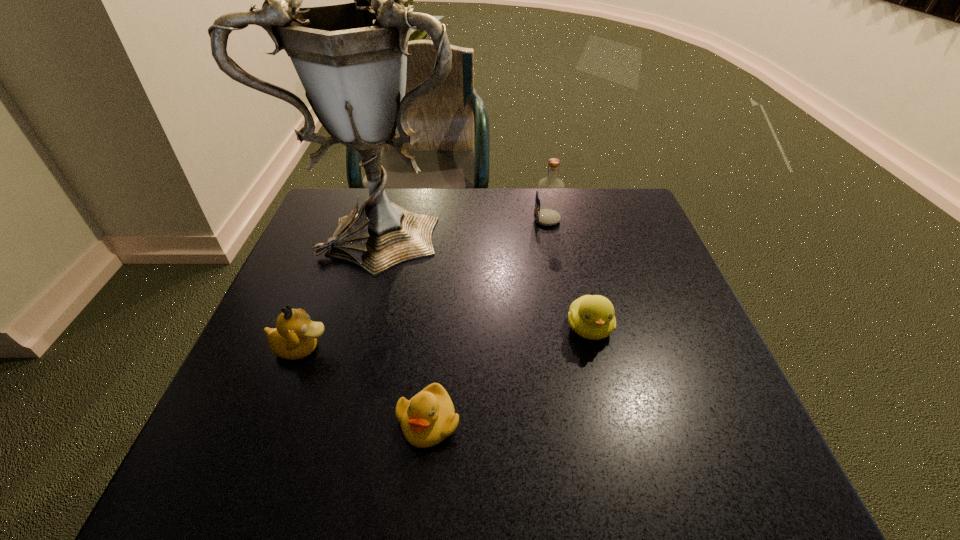
The width and height of the screenshot is (960, 540). In order to click on free region located 0.280m on the label of the second tallest object in this screenshot , I will do pyautogui.click(x=431, y=220).

Locate an element on the screen. This screenshot has height=540, width=960. vacant space located on the face of the leftmost duckling is located at coordinates coord(486,348).

Image resolution: width=960 pixels, height=540 pixels. What are the coordinates of `free space located at the beak of the rightmost duckling` in the screenshot? It's located at (603, 384).

Locate an element on the screen. This screenshot has height=540, width=960. trophy cup that is at the far edge is located at coordinates (351, 58).

Find the location of a particular element. This screenshot has height=540, width=960. vodka present at the far edge is located at coordinates (550, 190).

This screenshot has height=540, width=960. In order to click on object at the near edge in this screenshot , I will do `click(429, 417)`.

At what (x,y) coordinates should I click in order to perform the action: click on trophy cup positioned at the left edge. Please return your answer as a coordinate pair (x, y). Looking at the image, I should click on (351, 58).

This screenshot has height=540, width=960. I want to click on duckling at the left edge, so click(x=295, y=337).

Identify the location of object located at the far left corner. The width and height of the screenshot is (960, 540). (351, 58).

The height and width of the screenshot is (540, 960). I want to click on vacant region at the far edge, so click(580, 199).